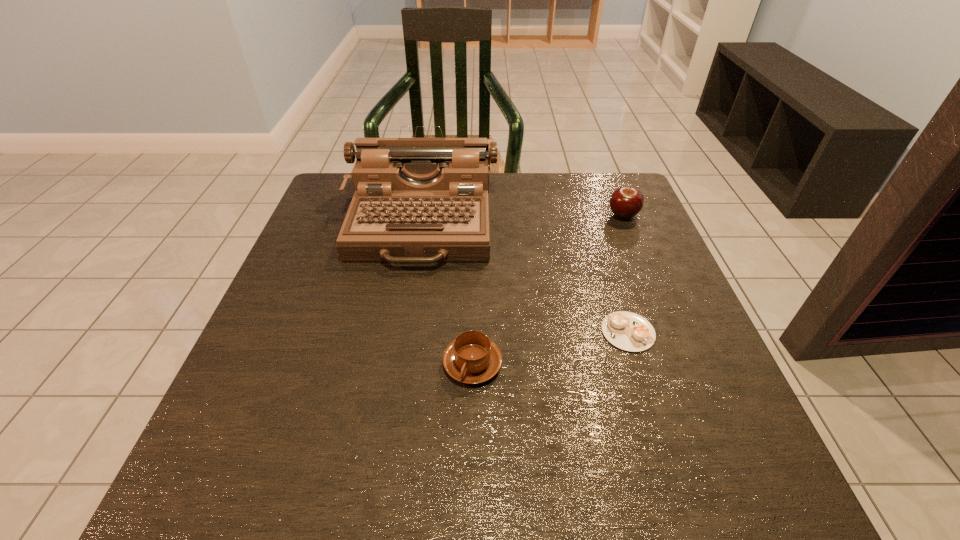
This screenshot has height=540, width=960. I want to click on vacant region at the right edge of the desktop, so click(x=732, y=442).

Where is `vacant position at the near left corner of the desktop`? The image size is (960, 540). vacant position at the near left corner of the desktop is located at coordinates (256, 456).

Find the location of a particular element. This screenshot has width=960, height=540. free region at the far right corner of the desktop is located at coordinates (636, 221).

This screenshot has width=960, height=540. Find the location of `free point at the near right corner`. free point at the near right corner is located at coordinates (699, 485).

This screenshot has height=540, width=960. In order to click on vacant region between the right cappuccino and the tallest object in this screenshot , I will do `click(524, 278)`.

At what (x,y) coordinates should I click in order to perform the action: click on free space between the apple and the shorter cappuccino. Please return your answer as a coordinate pair (x, y). Looking at the image, I should click on (626, 274).

Identify the location of vacant area that lies between the right cappuccino and the third shortest object. (626, 274).

The height and width of the screenshot is (540, 960). Identify the location of free space between the right cappuccino and the second shortest object. (550, 348).

The width and height of the screenshot is (960, 540). Find the location of `blank region between the apple and the taller cappuccino`. blank region between the apple and the taller cappuccino is located at coordinates (548, 289).

At what (x,y) coordinates should I click in order to perform the action: click on free area in between the second tallest object and the third tallest object. Please return your answer as a coordinate pair (x, y). This screenshot has height=540, width=960. Looking at the image, I should click on [x=548, y=289].